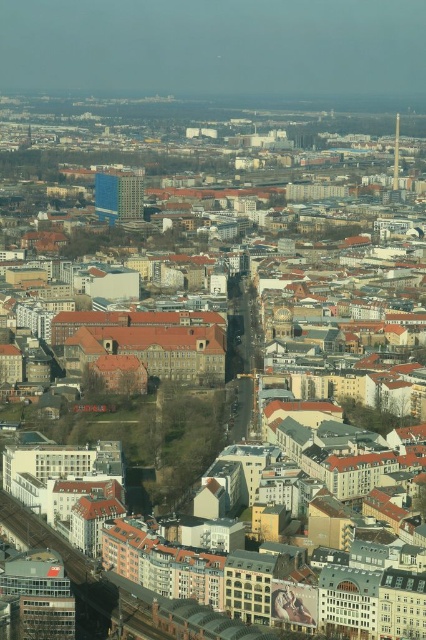
You are a drone operator trying to navigate between two buildings in the city. You see the blue glass building at center and the metallic silver tower at upper right. Which building is located to the left when looking from the other building?

The blue glass building at center is positioned on the left side of metallic silver tower at upper right, so when looking from the metallic silver tower at upper right, the blue glass building at center is to the left.

You are a drone operator trying to navigate between two points in the city. You see the point at (126, 180) and the point at (396, 115) in the image. Which point is closer to your current position?

Point at (126, 180) is closer to the viewer than point at (396, 115), so the point at (126, 180) is closer to your current position.

You are a city planner analyzing the urban layout. Given the blue glass building at center and the metallic silver tower at upper right, which one occupies more floor space in the city?

The blue glass building at center is bigger than the metallic silver tower at upper right, so it occupies more floor space.